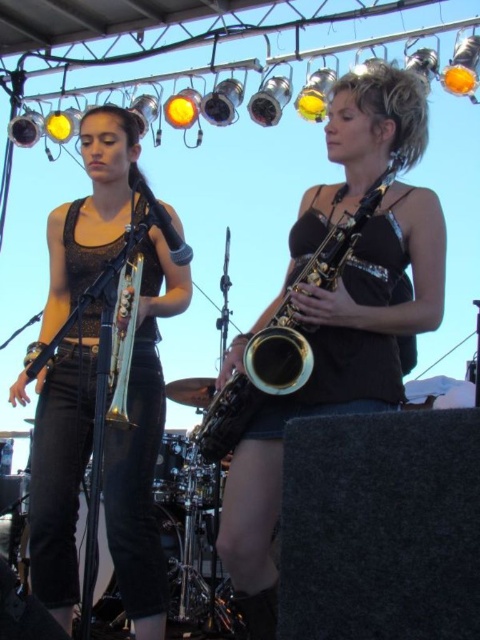
You are a stagehand setting up for a performance. You need to place a new microphone stand between the shiny gold saxophone at center and the matte black trombone at left. Considering their sizes, which instrument should the microphone stand be closer to?

The shiny gold saxophone at center occupies less space than the matte black trombone at left, so the microphone stand should be placed closer to the shiny gold saxophone at center to accommodate the larger size of the matte black trombone at left.

You are a stagehand setting up the stage for a performance. You have to place the matte black trombone at left and the gold lacquered saxophone at center. Based on their sizes, which instrument should you allocate more space for?

The matte black trombone at left is bigger than the gold lacquered saxophone at center, so you should allocate more space for the matte black trombone at left.